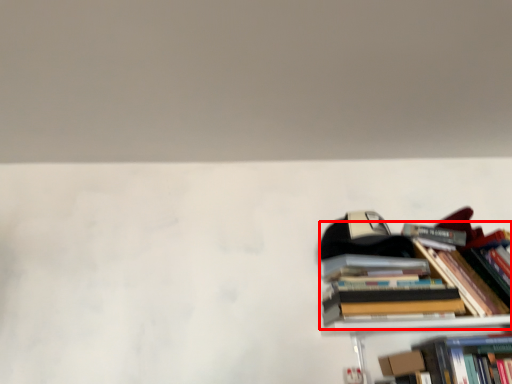
Question: From the image's perspective, considering the relative positions of book (annotated by the red box) and paperback book in the image provided, where is book (annotated by the red box) located with respect to the staircase?

Choices:
 (A) above
 (B) below

Answer: (A)